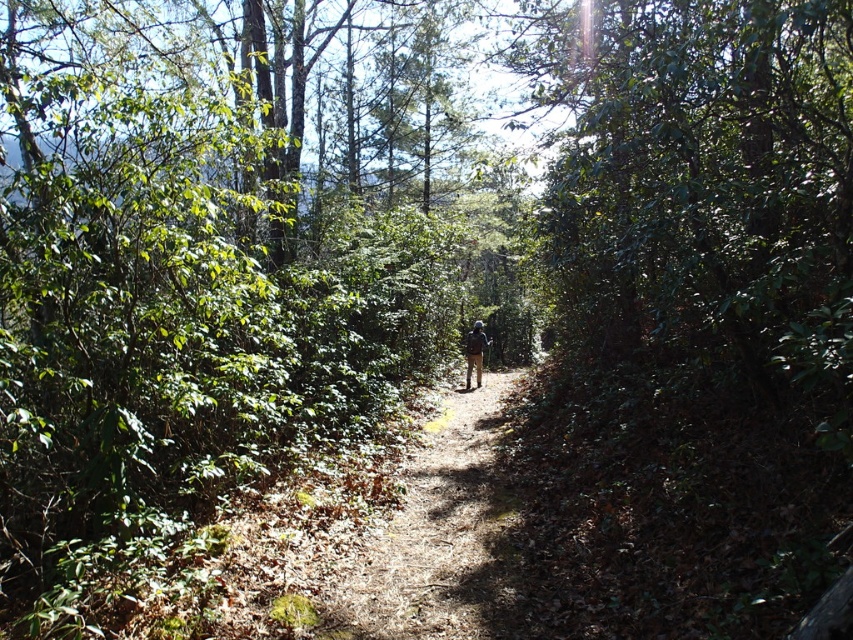
Question: Which of the following is the farthest from the observer?

Choices:
 (A) (474, 374)
 (B) (495, 516)

Answer: (A)

Question: Is brown dirt path at center above dark green backpack at center?

Choices:
 (A) yes
 (B) no

Answer: (B)

Question: Does brown dirt path at center appear on the left side of dark green backpack at center?

Choices:
 (A) no
 (B) yes

Answer: (B)

Question: Which point appears closest to the camera in this image?

Choices:
 (A) (477, 384)
 (B) (459, 476)

Answer: (B)

Question: Which object is closer to the camera taking this photo?

Choices:
 (A) brown dirt path at center
 (B) dark green backpack at center

Answer: (A)

Question: Can you confirm if brown dirt path at center is wider than dark green backpack at center?

Choices:
 (A) yes
 (B) no

Answer: (A)